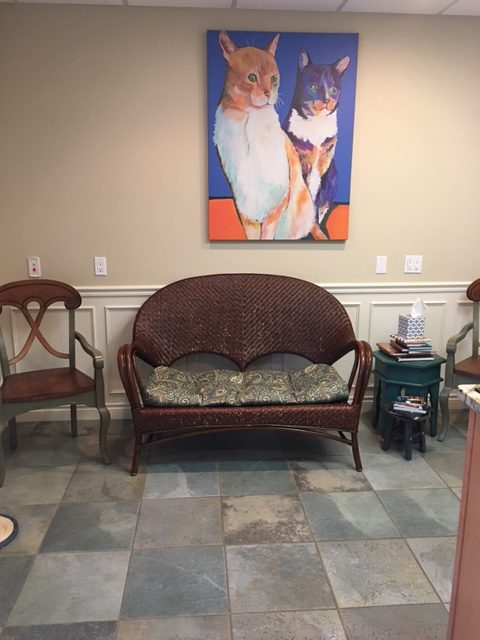
Identify the location of something to place items on. [418, 377], [401, 417], [466, 390].